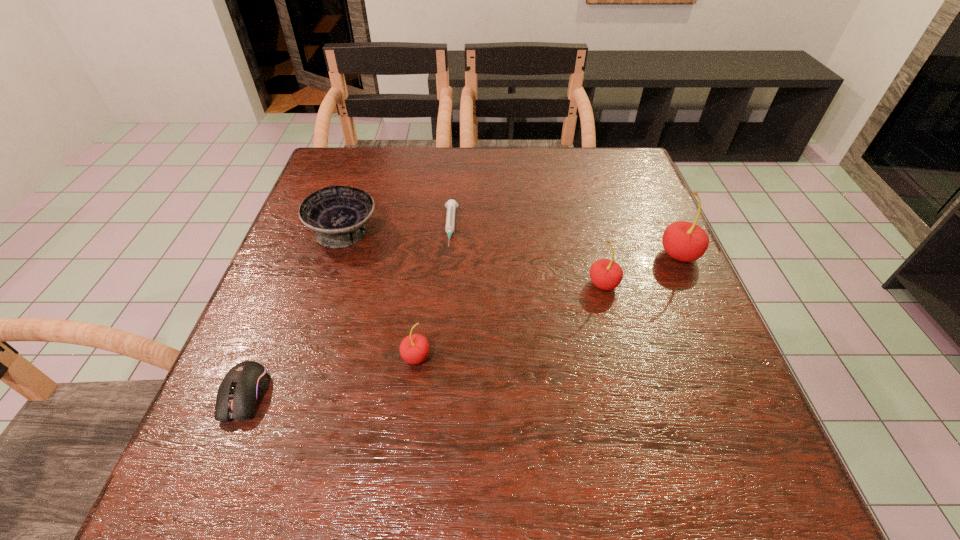
Locate an element on the screen. This screenshot has width=960, height=540. the third tallest object is located at coordinates (414, 349).

Where is `the shortest cherry`? This screenshot has height=540, width=960. the shortest cherry is located at coordinates (414, 349).

Find the location of a particular element. the second cherry from right to left is located at coordinates (605, 274).

You are a GUI agent. You are given a task and a screenshot of the screen. Output one action in this format:
    pyautogui.click(x=<x>, y=<y>)
    Task: Click on the fourth farthest object
    This screenshot has width=960, height=540.
    Given the screenshot: What is the action you would take?
    pyautogui.click(x=605, y=274)

At what (x,y) coordinates should I click in order to perform the action: click on the rightmost cherry. Please return your answer as a coordinate pair (x, y). The height and width of the screenshot is (540, 960). Looking at the image, I should click on (684, 241).

Identify the location of the tallest cherry. Image resolution: width=960 pixels, height=540 pixels. (684, 241).

Locate an element on the screen. Image resolution: width=960 pixels, height=540 pixels. syringe is located at coordinates (451, 204).

Where is `the shortest object`? This screenshot has width=960, height=540. the shortest object is located at coordinates (451, 204).

Where is `the third shortest object`? the third shortest object is located at coordinates pyautogui.click(x=337, y=213).

The width and height of the screenshot is (960, 540). I want to click on computer mouse, so click(243, 386).